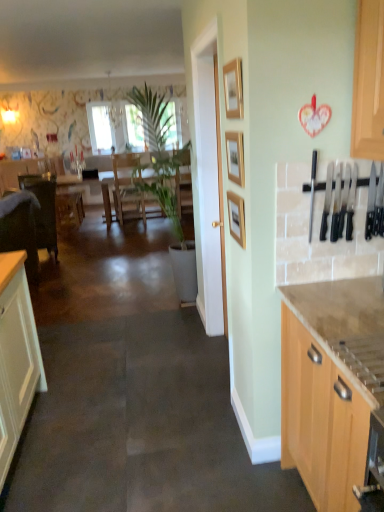
Question: Is point (231, 197) closer or farther from the camera than point (188, 186)?

Choices:
 (A) closer
 (B) farther

Answer: (A)

Question: Would you say wooden picture frame at center, the first picture frame ordered from the bottom, is to the left or to the right of wooden table at center in the picture?

Choices:
 (A) right
 (B) left

Answer: (A)

Question: Which object is the farthest from the light wood cabinet at right?

Choices:
 (A) transparent glass window at center
 (B) wooden picture frame at center, positioned as the third picture frame in top-to-bottom order
 (C) wooden picture frame at upper center, marked as the 1th picture frame in a top-to-bottom arrangement
 (D) wooden table at center
 (E) wooden picture frame at upper center, the 2th picture frame from the bottom

Answer: (A)

Question: Which of these objects is positioned closest to the light wood cabinet at right?

Choices:
 (A) transparent glass window at center
 (B) wooden picture frame at center, positioned as the third picture frame in top-to-bottom order
 (C) wooden picture frame at upper center, the 2th picture frame from the bottom
 (D) wooden table at center
 (E) wooden picture frame at upper center, the 3th picture frame positioned from the bottom

Answer: (B)